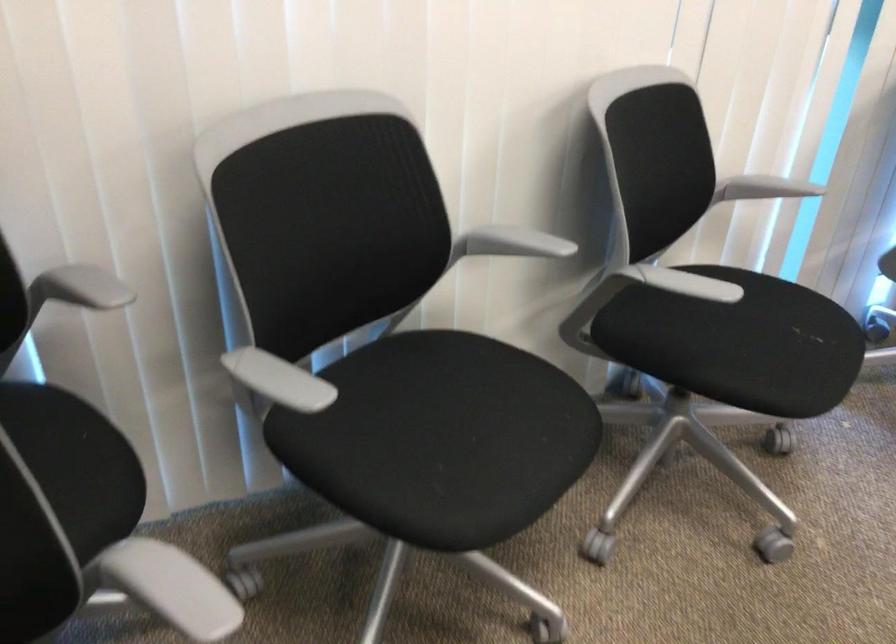
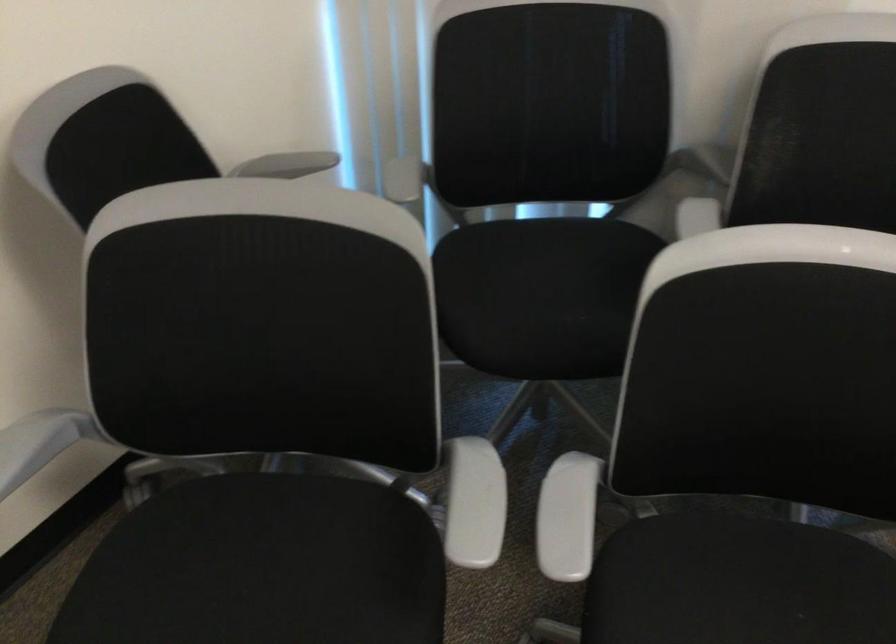
The images are taken continuously from a first-person perspective. In which direction is your viewpoint rotating?

The camera rotated toward left-down.